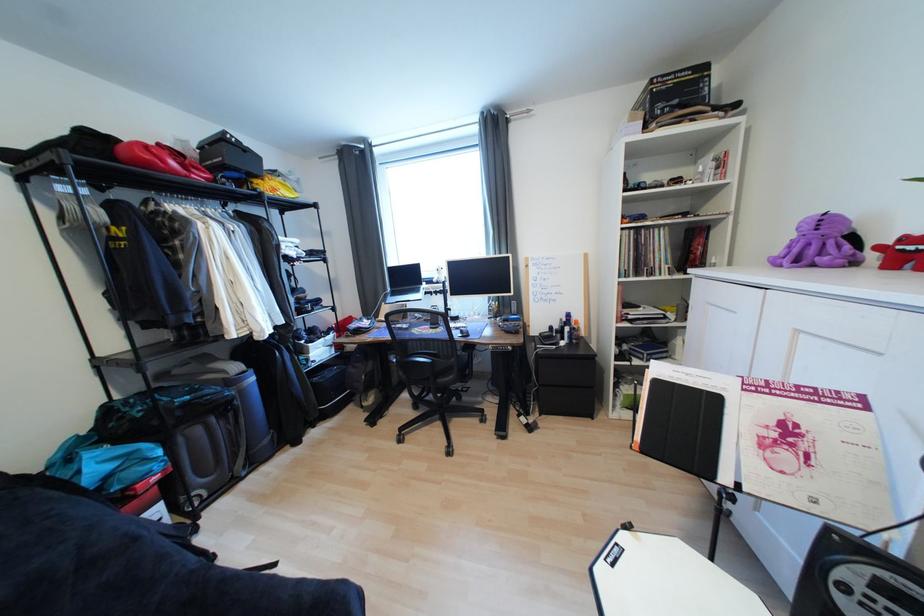
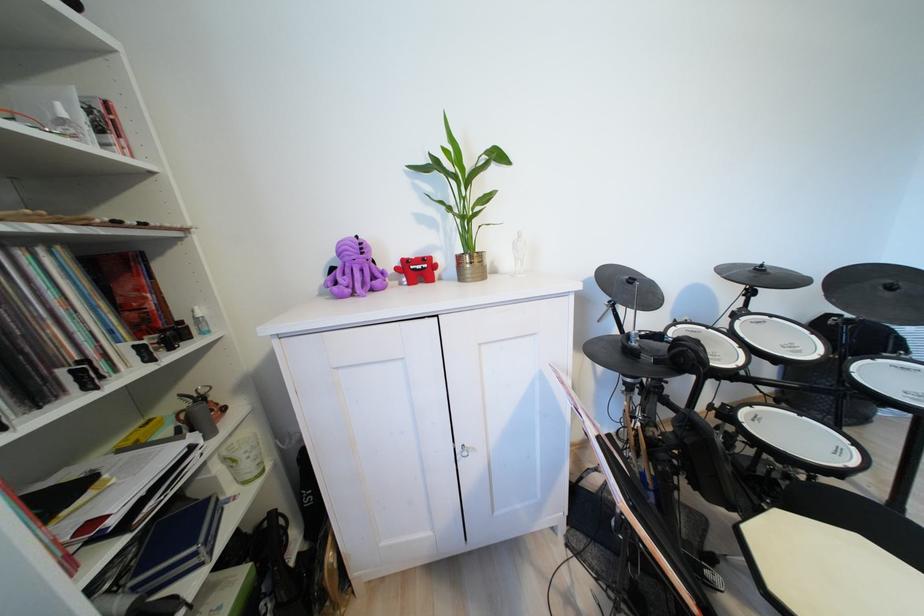
Where in the second image is the point corresponding to point 833,248 from the first image?

(360, 274)